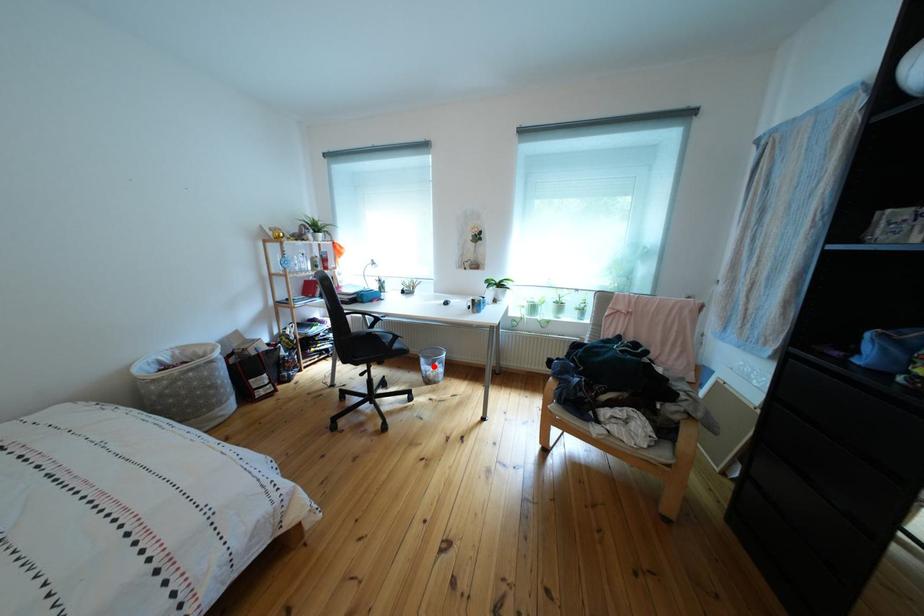
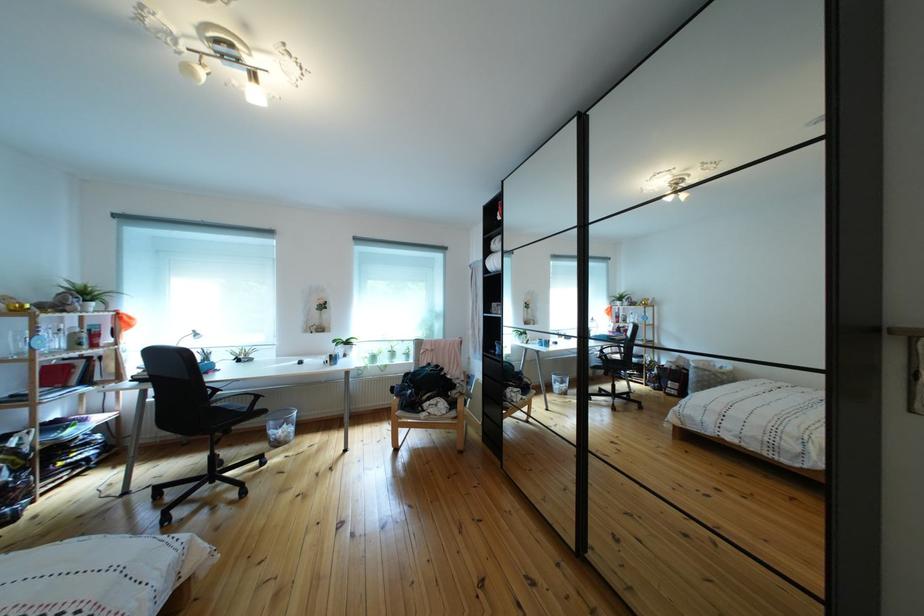
In the second image, find the point that corresponds to the highlighted location in the first image.

(283, 430)